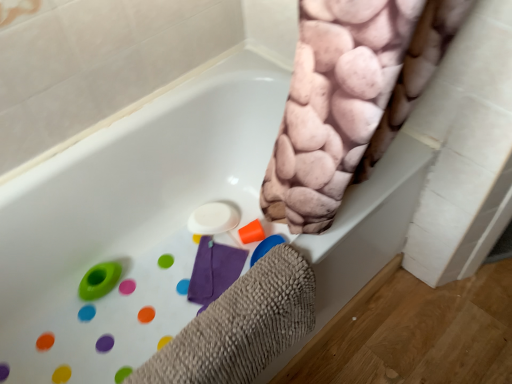
In the scene shown: In order to face beige microfiber towel at lower center, should I rotate leftwards or rightwards?

To face it directly, rotate left by 4.434 degrees.

What do you see at coordinates (240, 326) in the screenshot? The height and width of the screenshot is (384, 512). I see `beige microfiber towel at lower center` at bounding box center [240, 326].

At what (x,y) coordinates should I click in order to perform the action: click on beige microfiber towel at lower center. Please return your answer as a coordinate pair (x, y). The image size is (512, 384). Looking at the image, I should click on (240, 326).

Where is `beige microfiber towel at lower center`? The width and height of the screenshot is (512, 384). beige microfiber towel at lower center is located at coordinates [x=240, y=326].